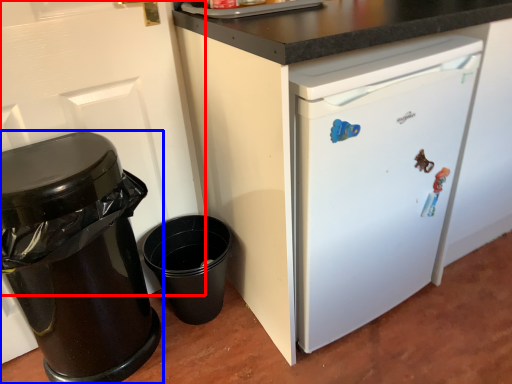
Question: Among these objects, which one is nearest to the camera, door (highlighted by a red box) or waste container (highlighted by a blue box)?

Choices:
 (A) door
 (B) waste container

Answer: (A)